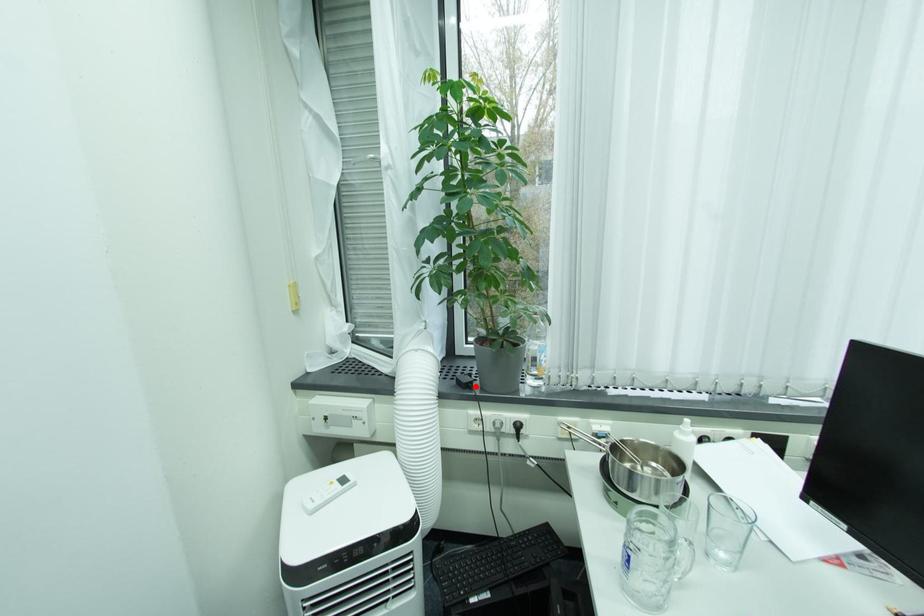
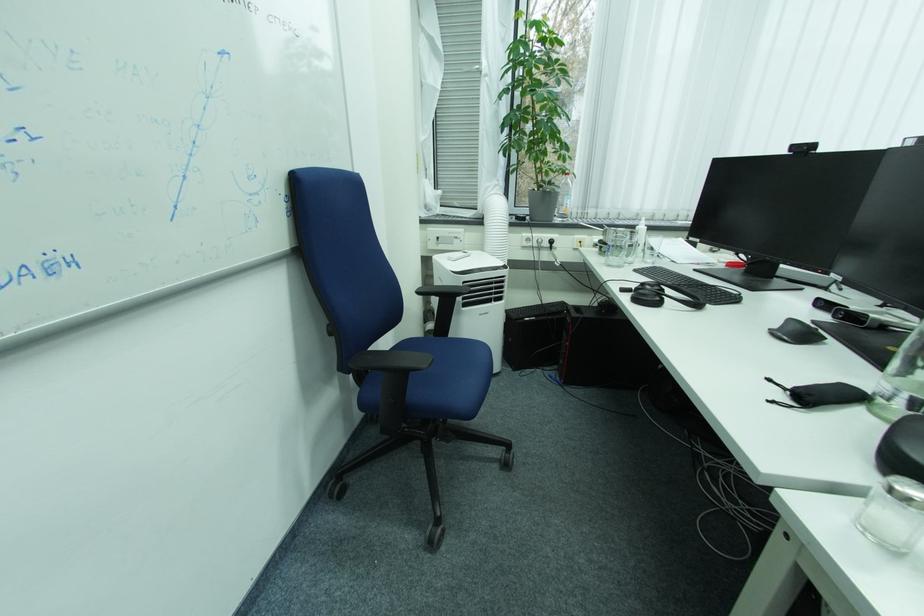
Question: I am providing you with two images of the same scene from different viewpoints. A red point is shown in image1. For the corresponding object point in image2, is it positioned nearer or farther from the camera?

Choices:
 (A) Nearer
 (B) Farther

Answer: (A)